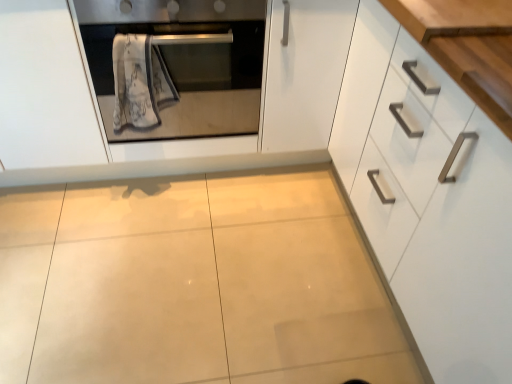
Question: Is white textured towel at center oriented towards wooden at upper right?

Choices:
 (A) yes
 (B) no

Answer: (B)

Question: From a real-world perspective, is white textured towel at center positioned over wooden at upper right based on gravity?

Choices:
 (A) no
 (B) yes

Answer: (A)

Question: Can we say white textured towel at center lies outside wooden at upper right?

Choices:
 (A) yes
 (B) no

Answer: (A)

Question: Does white textured towel at center have a smaller size compared to wooden at upper right?

Choices:
 (A) no
 (B) yes

Answer: (A)

Question: Considering the relative sizes of white textured towel at center and wooden at upper right in the image provided, is white textured towel at center thinner than wooden at upper right?

Choices:
 (A) no
 (B) yes

Answer: (B)

Question: Does white textured towel at center have a larger size compared to wooden at upper right?

Choices:
 (A) yes
 (B) no

Answer: (A)

Question: Is white glossy cabinet at right positioned far away from white textured towel at center?

Choices:
 (A) yes
 (B) no

Answer: (B)

Question: Is white glossy cabinet at right not inside white textured towel at center?

Choices:
 (A) no
 (B) yes

Answer: (B)

Question: Does white glossy cabinet at right have a larger size compared to white textured towel at center?

Choices:
 (A) yes
 (B) no

Answer: (A)

Question: Is white glossy cabinet at right looking in the opposite direction of white textured towel at center?

Choices:
 (A) no
 (B) yes

Answer: (A)

Question: Considering the relative positions of white glossy cabinet at right and white textured towel at center in the image provided, is white glossy cabinet at right behind white textured towel at center?

Choices:
 (A) no
 (B) yes

Answer: (A)

Question: Considering the relative positions of white glossy cabinet at right and white textured towel at center in the image provided, is white glossy cabinet at right in front of white textured towel at center?

Choices:
 (A) yes
 (B) no

Answer: (A)

Question: From the image's perspective, does wooden at upper right appear higher than satin silver oven at upper left?

Choices:
 (A) yes
 (B) no

Answer: (B)